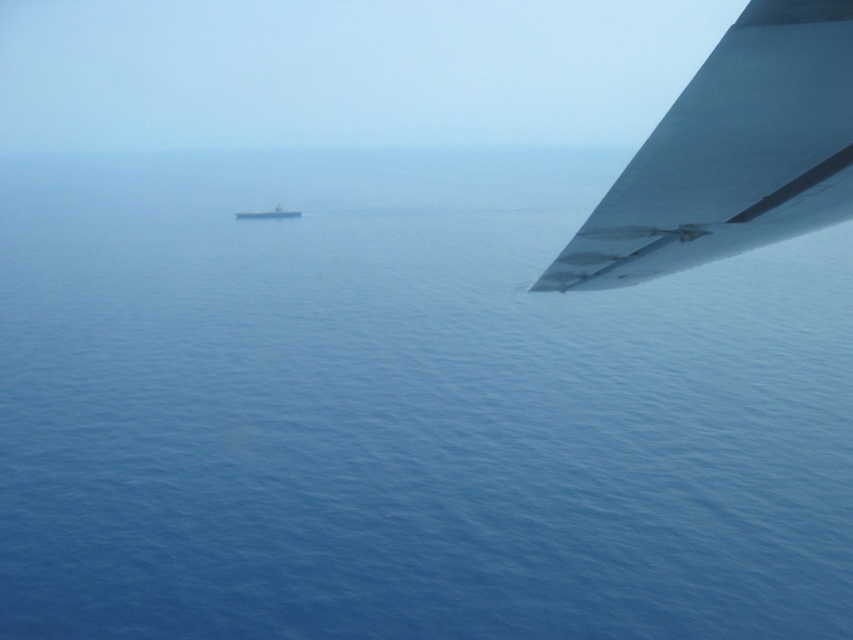
Question: Which object is farther from the camera taking this photo?

Choices:
 (A) metallic gray winglet at upper right
 (B) gray metallic boat at center

Answer: (B)

Question: Can you confirm if metallic gray winglet at upper right is wider than gray metallic boat at center?

Choices:
 (A) no
 (B) yes

Answer: (A)

Question: Among these points, which one is farthest from the camera?

Choices:
 (A) (248, 211)
 (B) (653, 177)

Answer: (A)

Question: Is metallic gray winglet at upper right above gray metallic boat at center?

Choices:
 (A) no
 (B) yes

Answer: (A)

Question: Does metallic gray winglet at upper right appear on the right side of gray metallic boat at center?

Choices:
 (A) yes
 (B) no

Answer: (A)

Question: Which of the following is the farthest from the observer?

Choices:
 (A) metallic gray winglet at upper right
 (B) gray metallic boat at center

Answer: (B)